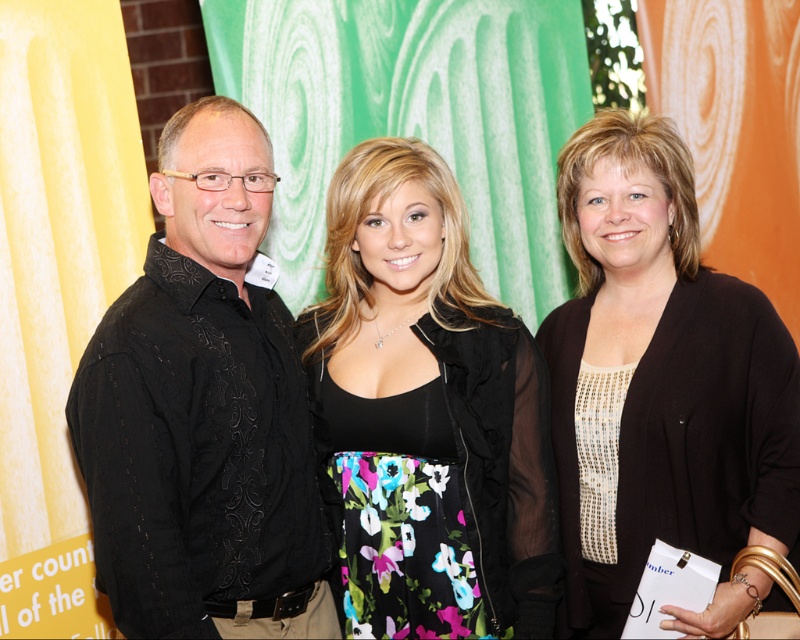
Does black embroidered shirt at left appear over black satin dress at center?

Correct, black embroidered shirt at left is located above black satin dress at center.

Who is positioned more to the left, black embroidered shirt at left or black satin dress at center?

Positioned to the left is black embroidered shirt at left.

Does point (200, 621) lie in front of point (408, 156)?

Yes, it is in front of point (408, 156).

This screenshot has width=800, height=640. Identify the location of black embroidered shirt at left. (204, 412).

Who is taller, sequined beige blouse at center or black satin dress at center?

sequined beige blouse at center is taller.

Image resolution: width=800 pixels, height=640 pixels. Describe the element at coordinates (662, 388) in the screenshot. I see `sequined beige blouse at center` at that location.

The height and width of the screenshot is (640, 800). What are the coordinates of `sequined beige blouse at center` in the screenshot? It's located at (662, 388).

Can you confirm if black embroidered shirt at left is positioned to the left of sequined beige blouse at center?

Indeed, black embroidered shirt at left is positioned on the left side of sequined beige blouse at center.

Does black embroidered shirt at left appear over sequined beige blouse at center?

No.

Where is `black embroidered shirt at left`? Image resolution: width=800 pixels, height=640 pixels. black embroidered shirt at left is located at coordinates (204, 412).

Find the location of a particular element. black embroidered shirt at left is located at coordinates (204, 412).